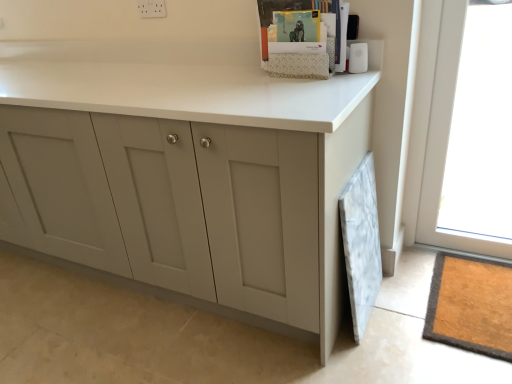
Image resolution: width=512 pixels, height=384 pixels. What do you see at coordinates (474, 120) in the screenshot? I see `transparent glass window at upper right` at bounding box center [474, 120].

This screenshot has height=384, width=512. In order to click on transparent glass window at upper right in this screenshot , I will do `click(474, 120)`.

Where is `matte gray cabinet at center`? The height and width of the screenshot is (384, 512). matte gray cabinet at center is located at coordinates (196, 181).

What is the approximate width of matte gray cabinet at center?

matte gray cabinet at center is 64.26 centimeters wide.

The width and height of the screenshot is (512, 384). What do you see at coordinates (196, 181) in the screenshot?
I see `matte gray cabinet at center` at bounding box center [196, 181].

Where is `transparent glass window at upper right`? The height and width of the screenshot is (384, 512). transparent glass window at upper right is located at coordinates (474, 120).

Considering the relative positions of transparent glass window at upper right and matte gray cabinet at center in the image provided, is transparent glass window at upper right to the right of matte gray cabinet at center from the viewer's perspective?

Indeed, transparent glass window at upper right is positioned on the right side of matte gray cabinet at center.

Which object is further away from the camera taking this photo, transparent glass window at upper right or matte gray cabinet at center?

transparent glass window at upper right.

Is point (493, 4) farther from camera compared to point (85, 190)?

No, (493, 4) is closer to viewer.

From the image's perspective, which is above, transparent glass window at upper right or matte gray cabinet at center?

transparent glass window at upper right is shown above in the image.

From a real-world perspective, is transparent glass window at upper right positioned over matte gray cabinet at center based on gravity?

Yes, from a real-world perspective, transparent glass window at upper right is over matte gray cabinet at center

Considering the sizes of objects transparent glass window at upper right and matte gray cabinet at center in the image provided, who is wider, transparent glass window at upper right or matte gray cabinet at center?

Wider between the two is matte gray cabinet at center.

Can you confirm if transparent glass window at upper right is taller than matte gray cabinet at center?

Yes.

Who is bigger, transparent glass window at upper right or matte gray cabinet at center?

With larger size is matte gray cabinet at center.

Is transparent glass window at upper right not inside matte gray cabinet at center?

That's correct, transparent glass window at upper right is outside of matte gray cabinet at center.

Is transparent glass window at upper right directly adjacent to matte gray cabinet at center?

No.

Is transparent glass window at upper right oriented towards matte gray cabinet at center?

No.

How different are the orientations of transparent glass window at upper right and matte gray cabinet at center in degrees?

The angular difference between transparent glass window at upper right and matte gray cabinet at center is 0.000419 degrees.

Find the location of `cabinetry in front of the transparent glass window at upper right`. cabinetry in front of the transparent glass window at upper right is located at coordinates (196, 181).

Is matte gray cabinet at center at the right side of transparent glass window at upper right?

In fact, matte gray cabinet at center is to the left of transparent glass window at upper right.

Is matte gray cabinet at center in front of or behind transparent glass window at upper right in the image?

In the image, matte gray cabinet at center appears in front of transparent glass window at upper right.

Is point (233, 262) closer or farther from the camera than point (481, 184)?

Point (233, 262) is closer to the camera than point (481, 184).

From the image's perspective, is matte gray cabinet at center above or below transparent glass window at upper right?

→ matte gray cabinet at center is situated lower than transparent glass window at upper right in the image.

From a real-world perspective, is matte gray cabinet at center located beneath transparent glass window at upper right?

Correct, in the physical world, matte gray cabinet at center is lower than transparent glass window at upper right.

Is matte gray cabinet at center wider than transparent glass window at upper right?

Yes.

From their relative heights in the image, would you say matte gray cabinet at center is taller or shorter than transparent glass window at upper right?

In the image, matte gray cabinet at center appears to be shorter than transparent glass window at upper right.

Is matte gray cabinet at center smaller than transparent glass window at upper right?

Incorrect, matte gray cabinet at center is not smaller in size than transparent glass window at upper right.

Is matte gray cabinet at center not inside transparent glass window at upper right?

Yes, matte gray cabinet at center is outside of transparent glass window at upper right.

Is matte gray cabinet at center far away from transparent glass window at upper right?

No.

Is matte gray cabinet at center turned away from transparent glass window at upper right?

No.

How distant is matte gray cabinet at center from transparent glass window at upper right?

The distance of matte gray cabinet at center from transparent glass window at upper right is 92.15 centimeters.

Where is `cabinetry to the left of transparent glass window at upper right`? cabinetry to the left of transparent glass window at upper right is located at coordinates (196, 181).

At what (x,y) coordinates should I click in order to perform the action: click on cabinetry on the left of transparent glass window at upper right. Please return your answer as a coordinate pair (x, y). This screenshot has width=512, height=384. Looking at the image, I should click on (196, 181).

In order to click on window that is above the matte gray cabinet at center (from the image's perspective) in this screenshot , I will do `click(474, 120)`.